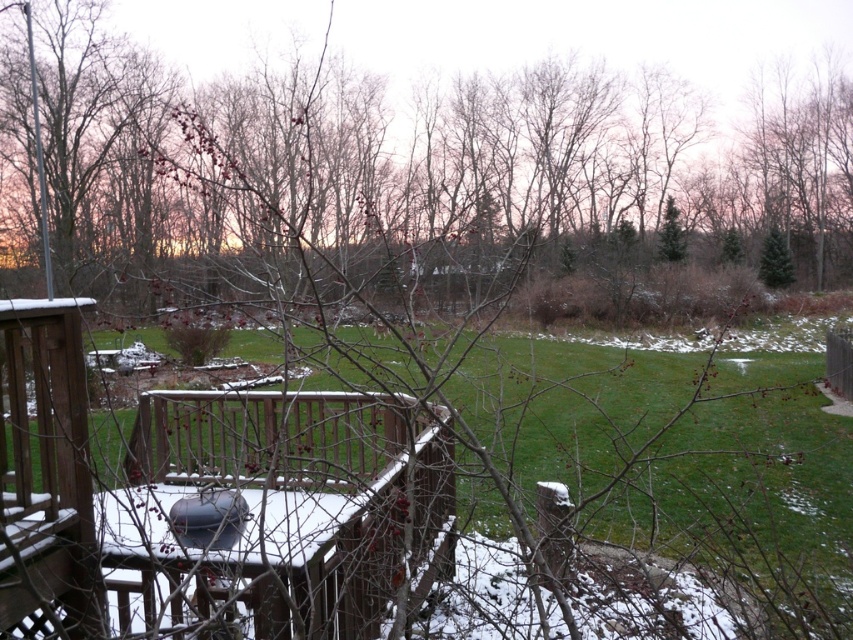
Question: Which of the following is the farthest from the observer?

Choices:
 (A) (271, 616)
 (B) (735, 580)

Answer: (B)

Question: Which object is closer to the camera taking this photo?

Choices:
 (A) green grass at center
 (B) wooden deck at lower left

Answer: (A)

Question: Is green grass at center below wooden deck at lower left?

Choices:
 (A) no
 (B) yes

Answer: (B)

Question: Is green grass at center below wooden deck at lower left?

Choices:
 (A) no
 (B) yes

Answer: (B)

Question: Does green grass at center have a larger size compared to wooden deck at lower left?

Choices:
 (A) no
 (B) yes

Answer: (B)

Question: Among these objects, which one is farthest from the camera?

Choices:
 (A) green grass at center
 (B) wooden deck at lower left

Answer: (B)